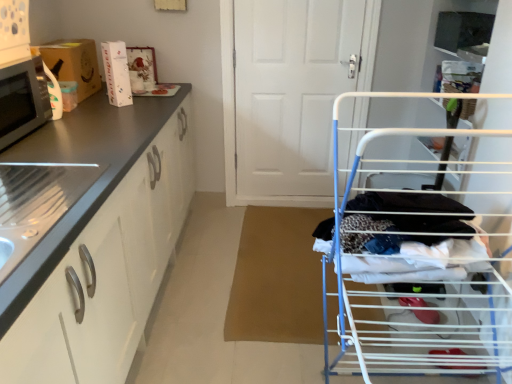
Where is `vacant space to the right of matte black microwave at left`? This screenshot has height=384, width=512. vacant space to the right of matte black microwave at left is located at coordinates (78, 135).